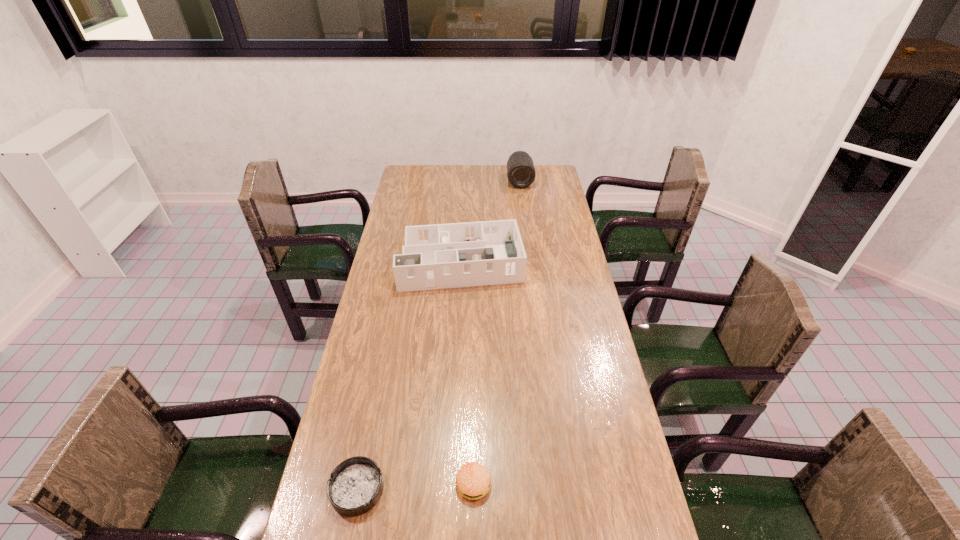
Locate an element on the screen. the farthest object is located at coordinates (521, 173).

Where is `the third nearest object`? The width and height of the screenshot is (960, 540). the third nearest object is located at coordinates (438, 256).

Identify the location of the second shortest object. This screenshot has width=960, height=540. (473, 481).

I want to click on the shortest object, so click(355, 486).

The width and height of the screenshot is (960, 540). I want to click on vacant area situated 0.250m on the surface of the telephoto lens, so click(525, 219).

Locate an element on the screen. This screenshot has width=960, height=540. vacant space positioned 0.110m on the right of the dollhouse is located at coordinates pyautogui.click(x=550, y=261).

Where is `vacant space located on the back of the second shortest object`? The width and height of the screenshot is (960, 540). vacant space located on the back of the second shortest object is located at coordinates click(x=475, y=345).

The height and width of the screenshot is (540, 960). I want to click on vacant space situated on the back of the ashtray, so click(373, 405).

Where is `object at the far edge`? object at the far edge is located at coordinates (x=521, y=173).

This screenshot has height=540, width=960. In order to click on dollhouse at the left edge in this screenshot , I will do `click(438, 256)`.